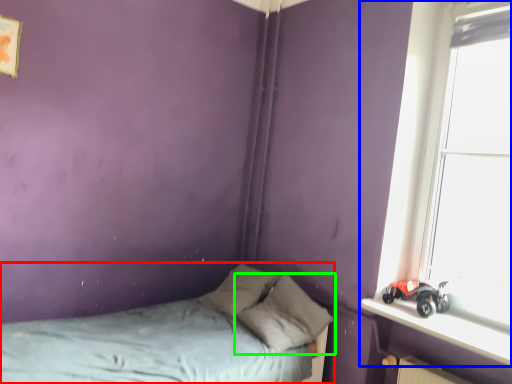
Question: Which is farther away from bed (highlighted by a red box)? window (highlighted by a blue box) or pillow (highlighted by a green box)?

Choices:
 (A) window
 (B) pillow

Answer: (A)